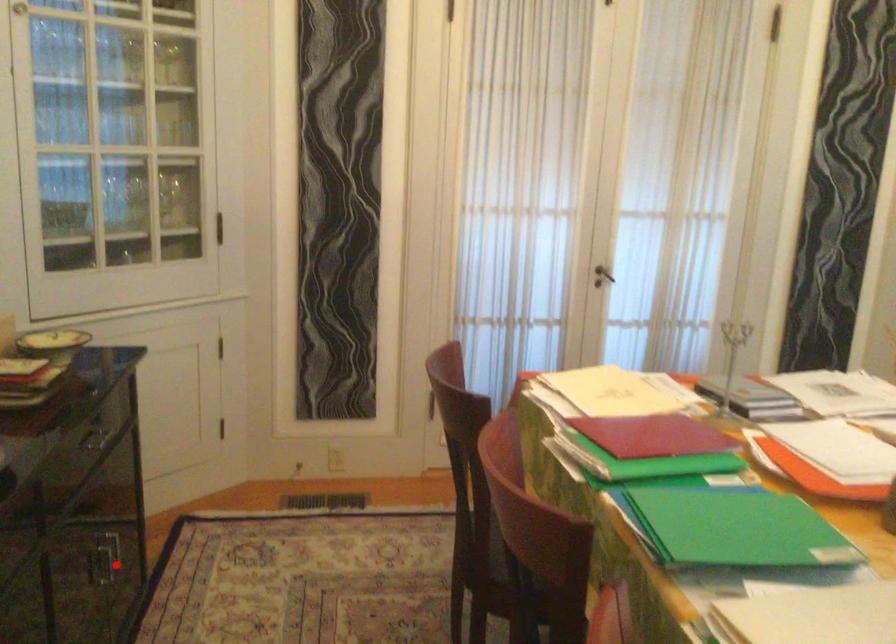
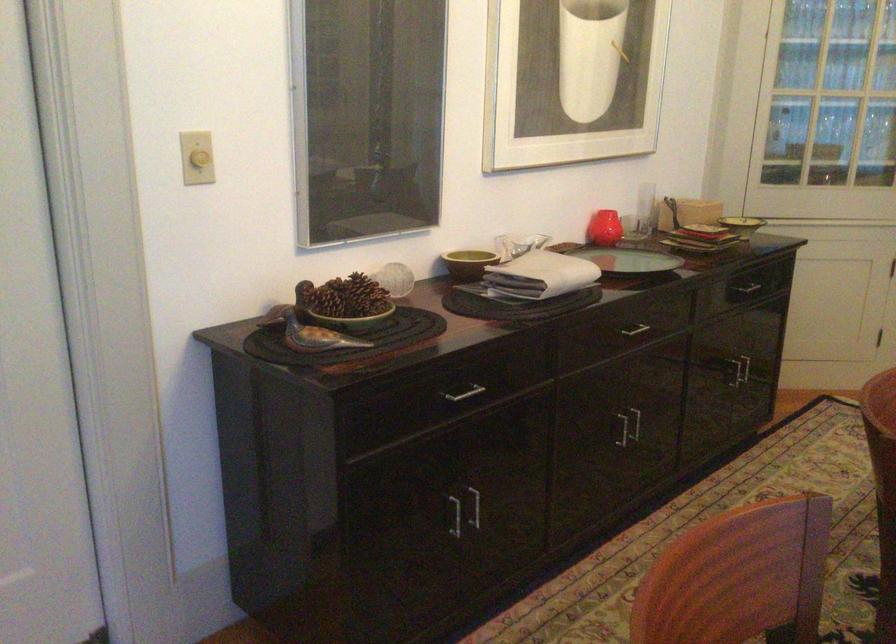
Question: A red point is marked in image1. In image2, is the corresponding 3D point closer to the camera or farther? Reply with the corresponding letter.

Choices:
 (A) The corresponding 3D point is closer.
 (B) The corresponding 3D point is farther.

Answer: (B)